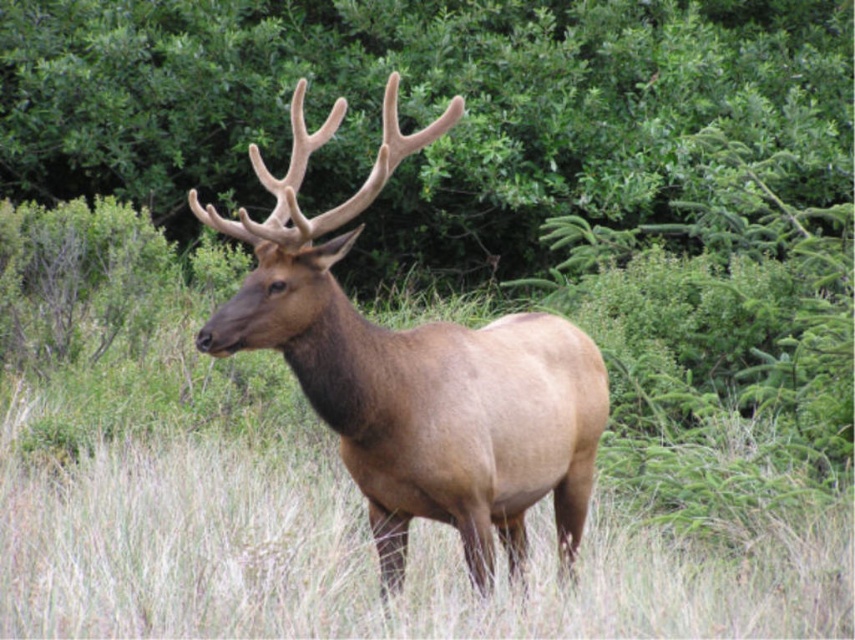
In the scene shown: Between green leafy tree at center and brown velvet deer at center, which one is positioned higher?

green leafy tree at center is above.

Which of these two, green leafy tree at center or brown velvet deer at center, stands taller?

With more height is brown velvet deer at center.

Where is `green leafy tree at center`? green leafy tree at center is located at coordinates coord(422,108).

Locate an element on the screen. The width and height of the screenshot is (855, 640). green leafy tree at center is located at coordinates (422, 108).